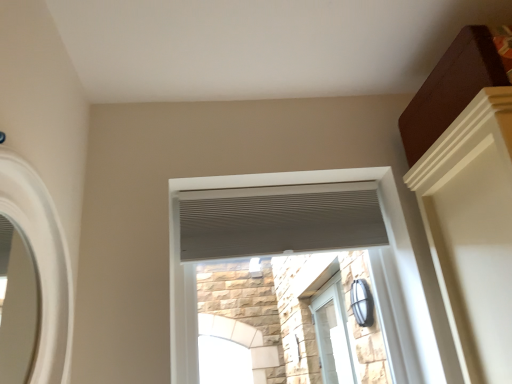
Question: From the image's perspective, is white textured blind at upper center located above or below white textured vent at center, which is the second window in bottom-to-top order?

Choices:
 (A) below
 (B) above

Answer: (B)

Question: Relative to white textured vent at center, marked as the 2th window in a top-to-bottom arrangement, is white textured blind at upper center in front or behind?

Choices:
 (A) front
 (B) behind

Answer: (B)

Question: Which is nearer to the white matte mirror at left, the third window viewed from the right?

Choices:
 (A) white textured blind at upper center
 (B) white textured vent at center, acting as the 2th window starting from the right
 (C) clear glass door at center, which ranks as the third window in front-to-back order

Answer: (B)

Question: Which is nearer to the white textured vent at center, marked as the 2th window in a top-to-bottom arrangement?

Choices:
 (A) white textured blind at upper center
 (B) white matte mirror at left, the third window viewed from the right
 (C) clear glass door at center, marked as the 3th window in a left-to-right arrangement

Answer: (A)